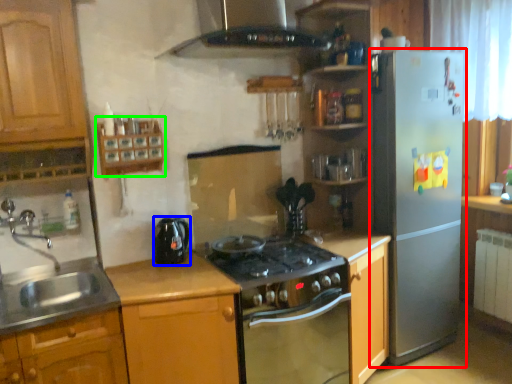
Question: Which is nearer to the refrigerator (highlighted by a red box)? kitchen appliance (highlighted by a blue box) or shelf (highlighted by a green box).

Choices:
 (A) kitchen appliance
 (B) shelf

Answer: (A)